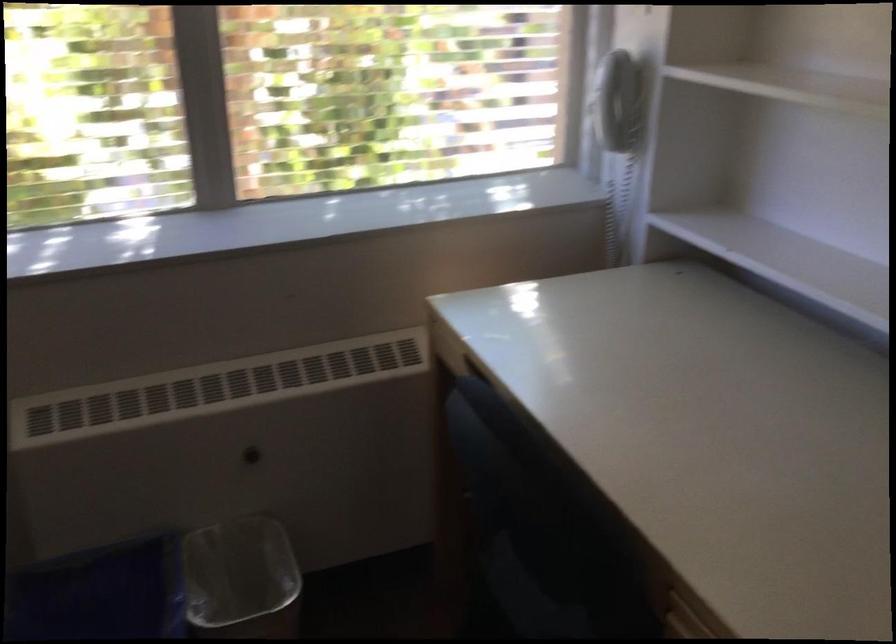
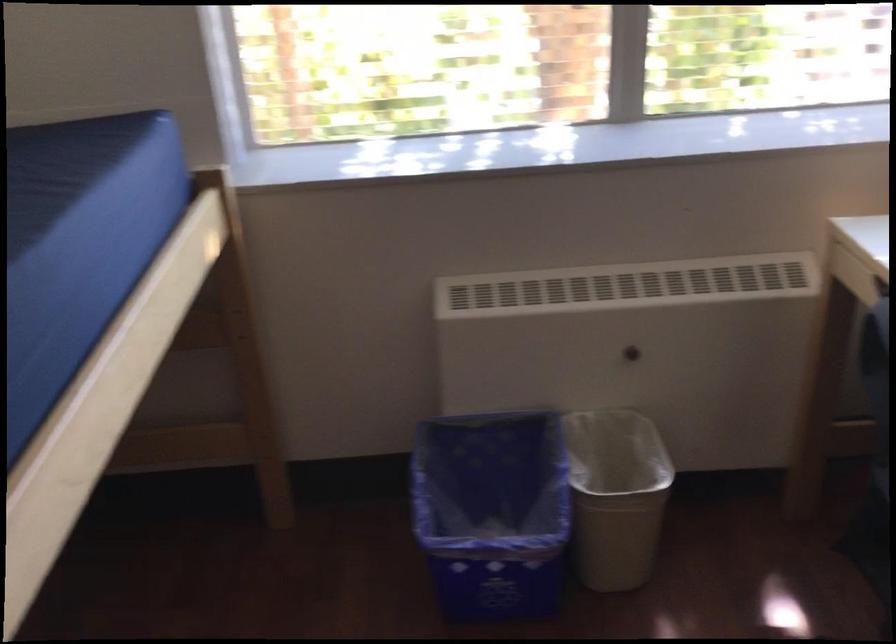
Where in the second image is the point corresponding to pixel 263 451 from the first image?

(634, 351)